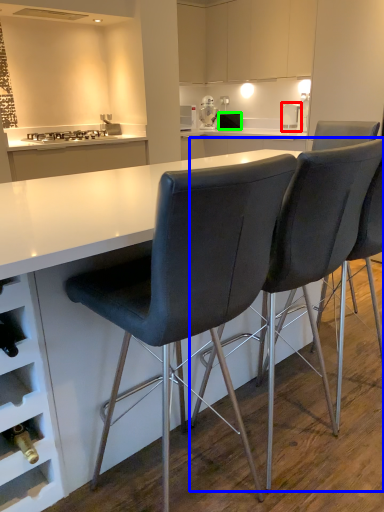
Question: Considering the real-world distances, which object is farthest from kitchen appliance (highlighted by a red box)? chair (highlighted by a blue box) or appliance (highlighted by a green box)?

Choices:
 (A) chair
 (B) appliance

Answer: (A)